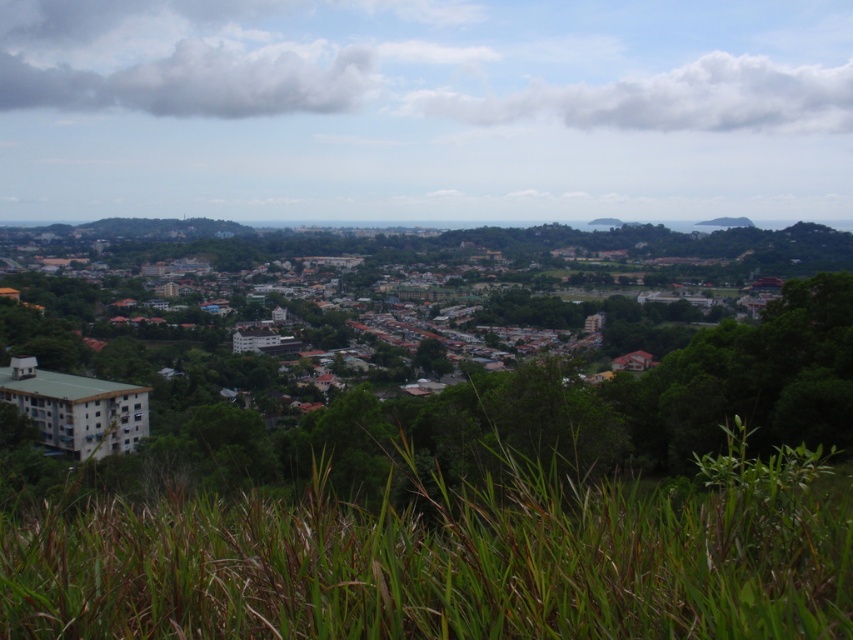
Question: Is white matte building at left thinner than green grass at lower center?

Choices:
 (A) no
 (B) yes

Answer: (A)

Question: Which point appears closest to the camera in this image?

Choices:
 (A) (577, 276)
 (B) (788, 536)

Answer: (B)

Question: Does white matte building at left appear on the right side of green grass at lower center?

Choices:
 (A) no
 (B) yes

Answer: (A)

Question: Can you confirm if white matte building at left is positioned above green grass at lower center?

Choices:
 (A) no
 (B) yes

Answer: (B)